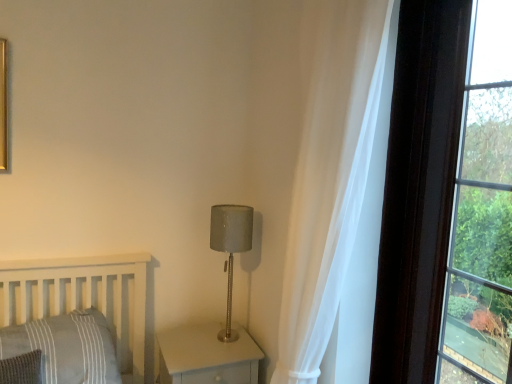
Where is `free space to the left of satin gray lampshade at center`? This screenshot has height=384, width=512. free space to the left of satin gray lampshade at center is located at coordinates (185, 342).